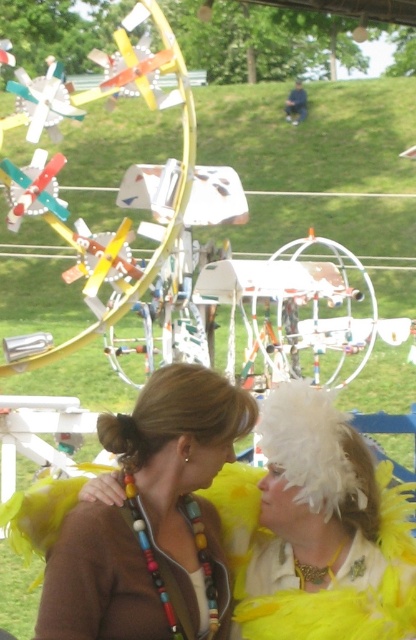
Who is more forward, (136,547) or (356,548)?

Point (136,547)

Between brown beaded necklace at center and white feathered headdress at upper center, which one has less height?

With less height is white feathered headdress at upper center.

The image size is (416, 640). What do you see at coordinates (151, 520) in the screenshot? I see `brown beaded necklace at center` at bounding box center [151, 520].

Find the location of a particular element. This screenshot has width=416, height=640. brown beaded necklace at center is located at coordinates (151, 520).

Does white feathered headdress at upper center appear under brown hair bun at center?

Indeed, white feathered headdress at upper center is positioned under brown hair bun at center.

Who is more distant from viewer, (292, 483) or (101, 429)?

Point (292, 483)

Where is `white feathered headdress at upper center`? This screenshot has height=640, width=416. white feathered headdress at upper center is located at coordinates (316, 522).

Find the location of a particular element. white feathered headdress at upper center is located at coordinates (316, 522).

Is brown beaded necklace at center positioned before brown hair bun at center?

Yes.

Locate an element on the screen. This screenshot has height=640, width=416. brown beaded necklace at center is located at coordinates (151, 520).